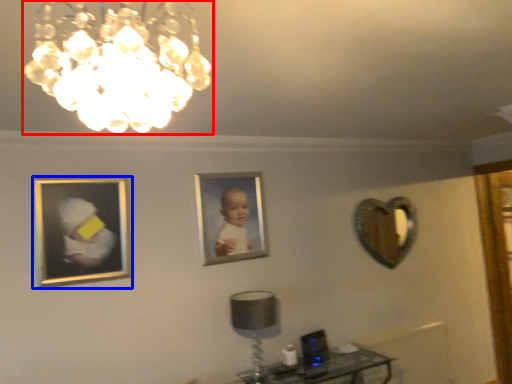
Question: Which object is further to the camera taking this photo, lamp (highlighted by a red box) or picture frame (highlighted by a blue box)?

Choices:
 (A) lamp
 (B) picture frame

Answer: (B)